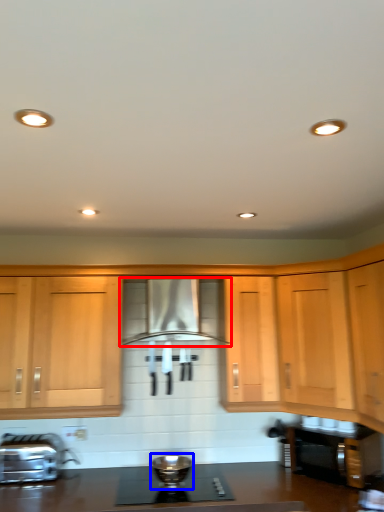
Question: Which object is further to the camera taking this photo, home appliance (highlighted by a red box) or appliance (highlighted by a blue box)?

Choices:
 (A) home appliance
 (B) appliance

Answer: (A)